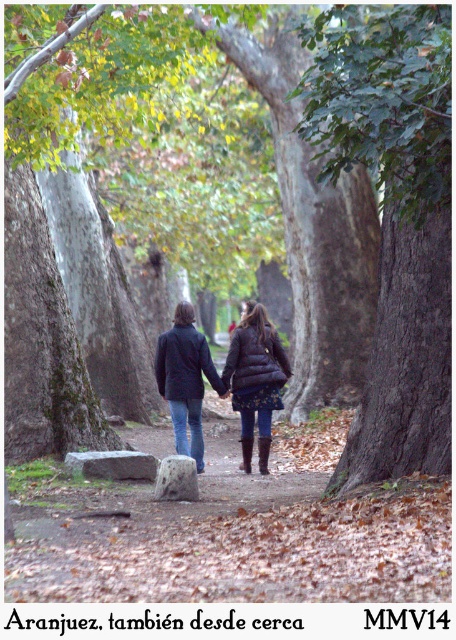
You are standing at the origin point in the image and want to locate the brown rough bark tree at center. What are the coordinates of this tree?

The coordinates of the brown rough bark tree at center are at point [393,218].

You are standing at the starting point of the tree path and want to take a photo of the brown rough bark tree at center. If your camera has a maximum focus range of 20 feet, will it be able to capture the tree clearly?

The brown rough bark tree at center is 19.70 feet away from the camera, which is within the maximum focus range of 20 feet. Therefore, the camera should be able to capture the tree clearly.